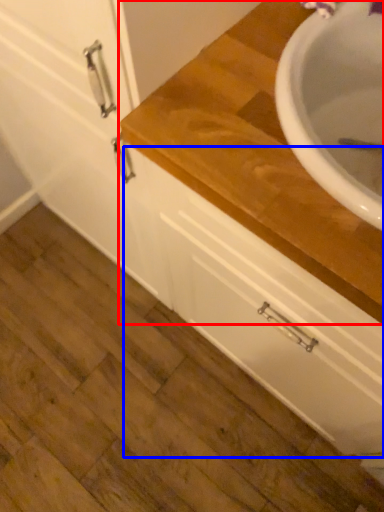
Question: Which object is closer to the camera taking this photo, countertop (highlighted by a red box) or drawer (highlighted by a blue box)?

Choices:
 (A) countertop
 (B) drawer

Answer: (A)